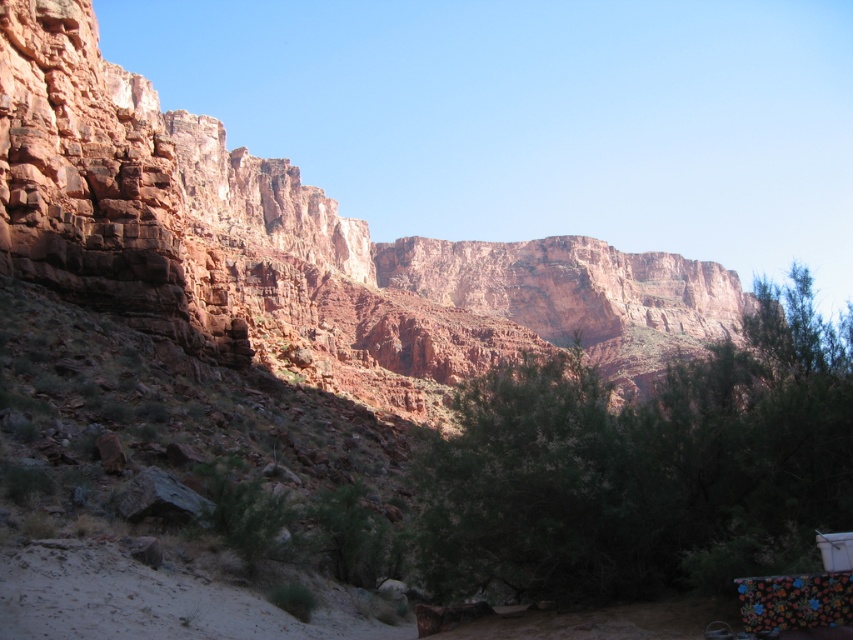
Is rustic rock formation at upper left below green leafy tree at center?

Actually, rustic rock formation at upper left is above green leafy tree at center.

What do you see at coordinates (297, 248) in the screenshot? Image resolution: width=853 pixels, height=640 pixels. I see `rustic rock formation at upper left` at bounding box center [297, 248].

Identify the location of rustic rock formation at upper left. This screenshot has width=853, height=640. (297, 248).